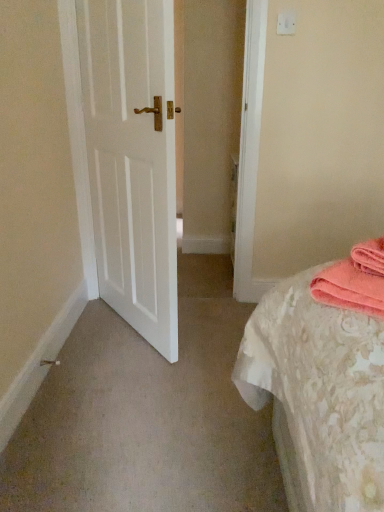
At what (x,y) coordinates should I click in order to perform the action: click on free location in front of white matte door at left. Please return your answer as a coordinate pair (x, y). Looking at the image, I should click on (133, 390).